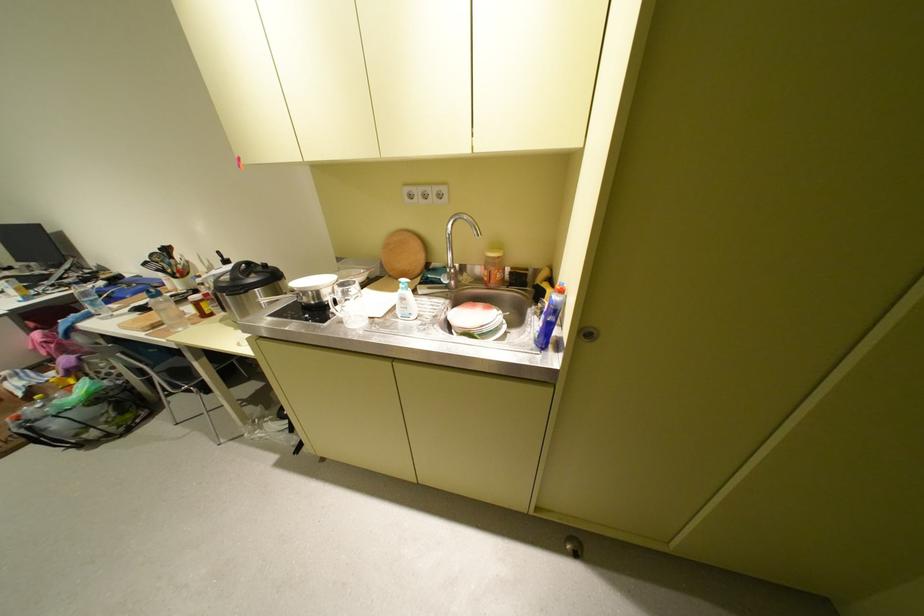
Where would you lift the metal faucet handle? Please return your answer as a coordinate pair (x, y).

(432, 276)